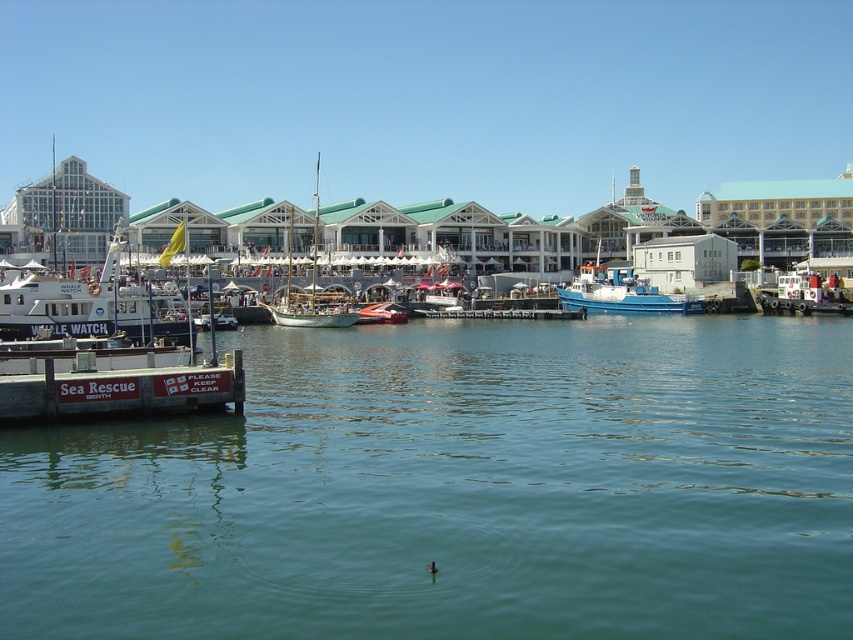
Which is in front, point (15, 410) or point (582, 301)?

Positioned in front is point (15, 410).

Who is taller, wooden dock at lower left or blue matte boat at center?

blue matte boat at center is taller.

Identify the location of wooden dock at lower left. This screenshot has height=640, width=853. (120, 390).

Which is behind, point (657, 301) or point (281, 321)?

Positioned behind is point (657, 301).

Which is more to the left, blue matte boat at center or wooden sailboat at center?

From the viewer's perspective, wooden sailboat at center appears more on the left side.

Is point (590, 264) closer to viewer compared to point (311, 301)?

No, (590, 264) is behind (311, 301).

Where is `blue matte boat at center`? blue matte boat at center is located at coordinates (622, 292).

Between green water at lower center and white matte boat at left, which one is positioned higher?

white matte boat at left is higher up.

At what (x,y) coordinates should I click in order to perform the action: click on green water at lower center. Please return your answer as a coordinate pair (x, y). Image resolution: width=853 pixels, height=640 pixels. Looking at the image, I should click on (457, 490).